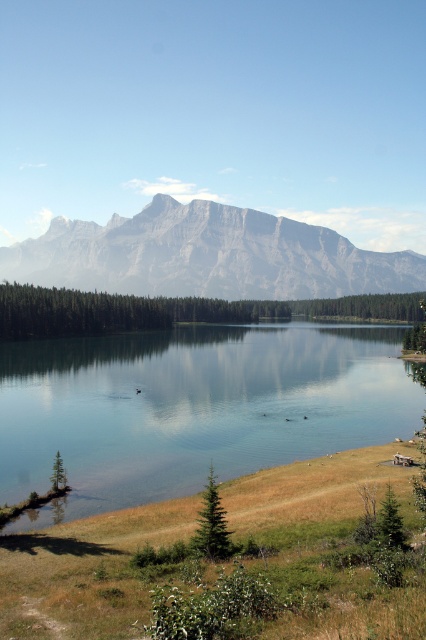
Does point (86, 312) come closer to viewer compared to point (196, 540)?

No, it is behind (196, 540).

Between green leafy trees at center and green matte tree at center, which one has more height?

green leafy trees at center is taller.

This screenshot has height=640, width=426. In order to click on green leafy trees at center in this screenshot , I will do `click(170, 310)`.

You are a GUI agent. You are given a task and a screenshot of the screen. Output one action in this format:
    pyautogui.click(x=<x>, y=<y>)
    Task: Click on the green leafy trees at center
    Image resolution: width=426 pixels, height=640 pixels.
    Given the screenshot: What is the action you would take?
    pyautogui.click(x=170, y=310)

Is point (166, 234) less distant than point (60, 481)?

No, (166, 234) is further to viewer.

Describe the element at coordinates (207, 257) in the screenshot. I see `gray rock mountain at upper center` at that location.

Which is behind, point (210, 244) or point (55, 477)?

Positioned behind is point (210, 244).

Where is `gray rock mountain at upper center`? gray rock mountain at upper center is located at coordinates (207, 257).

Does point (279, 330) come behind point (273, 317)?

No, (279, 330) is closer to viewer.

Does clear glass water at center have a larger size compared to green leafy trees at center?

Actually, clear glass water at center might be smaller than green leafy trees at center.

Who is more forward, (230, 394) or (423, 298)?

Point (230, 394)

At what (x,y) coordinates should I click in order to perform the action: click on clear glass water at center. Please return your answer as a coordinate pair (x, y). Looking at the image, I should click on (192, 406).